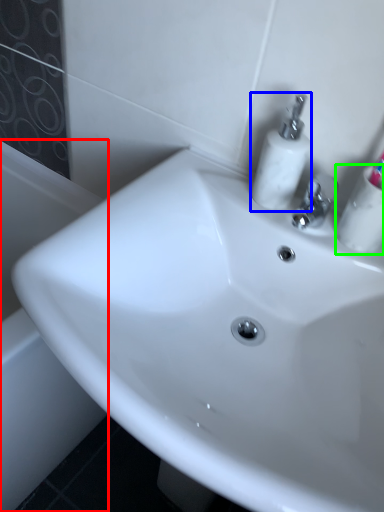
Question: Considering the real-world distances, which object is closest to bath (highlighted by a red box)? soap dispenser (highlighted by a blue box) or mouthwash (highlighted by a green box).

Choices:
 (A) soap dispenser
 (B) mouthwash

Answer: (A)